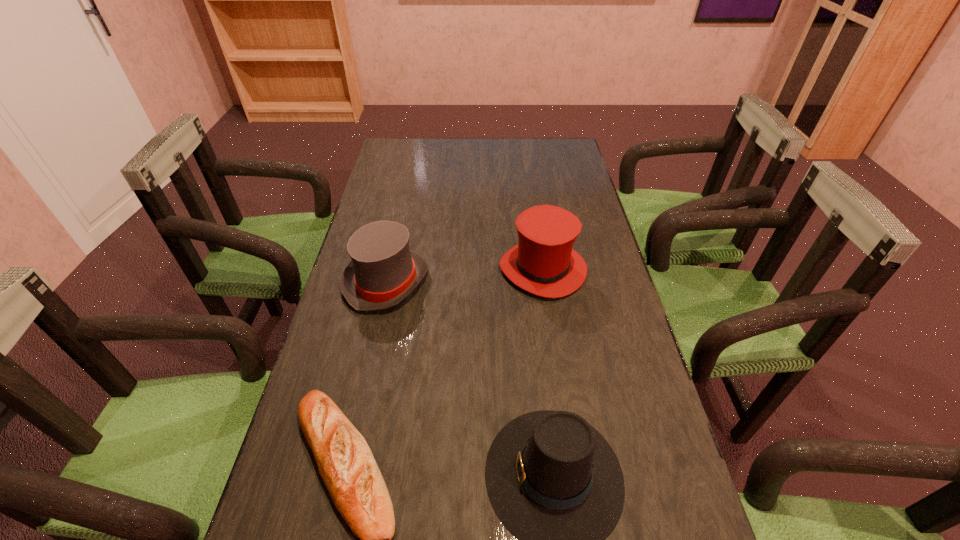
Locate an element on the screen. The image size is (960, 540). the leftmost dress hat is located at coordinates (383, 271).

At what (x,y) coordinates should I click in order to perform the action: click on free space located 0.380m on the back of the leftmost dress hat. Please return your answer as a coordinate pair (x, y). Looking at the image, I should click on (408, 184).

You are a GUI agent. You are given a task and a screenshot of the screen. Output one action in this format:
    pyautogui.click(x=<x>, y=<y>)
    Task: Click on the object that is positioned at the left edge
    
    Given the screenshot: What is the action you would take?
    pyautogui.click(x=383, y=271)

What are the coordinates of `object that is at the right edge` in the screenshot? It's located at (543, 263).

At what (x,y) coordinates should I click in order to perform the action: click on vacant region at the far edge of the desktop. Please return your answer as a coordinate pair (x, y). The height and width of the screenshot is (540, 960). Looking at the image, I should click on click(x=488, y=166).

Find the location of a particular element. vacant region at the left edge of the desktop is located at coordinates (342, 333).

This screenshot has height=540, width=960. In the image, there is a desktop. What are the coordinates of `vacant space at the right edge` in the screenshot? It's located at (612, 375).

Where is `free space at the far left corner`? The width and height of the screenshot is (960, 540). free space at the far left corner is located at coordinates (414, 143).

You are a GUI agent. You are given a task and a screenshot of the screen. Output one action in this format:
    pyautogui.click(x=<x>, y=<y>)
    Task: Click on the object that is the third closest to the leftmost dress hat
    The height and width of the screenshot is (540, 960).
    Given the screenshot: What is the action you would take?
    pyautogui.click(x=554, y=482)

Locate an element on the screen. the closest object relative to the leftmost dress hat is located at coordinates (543, 263).